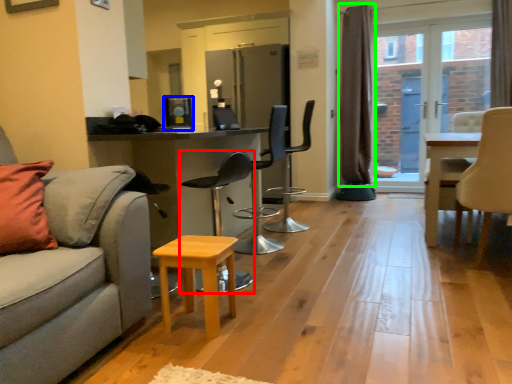
Question: Estimate the real-world distances between objects in this image. Which object is farther from chair (highlighted by a red box), appliance (highlighted by a blue box) or curtain (highlighted by a green box)?

Choices:
 (A) appliance
 (B) curtain

Answer: (B)